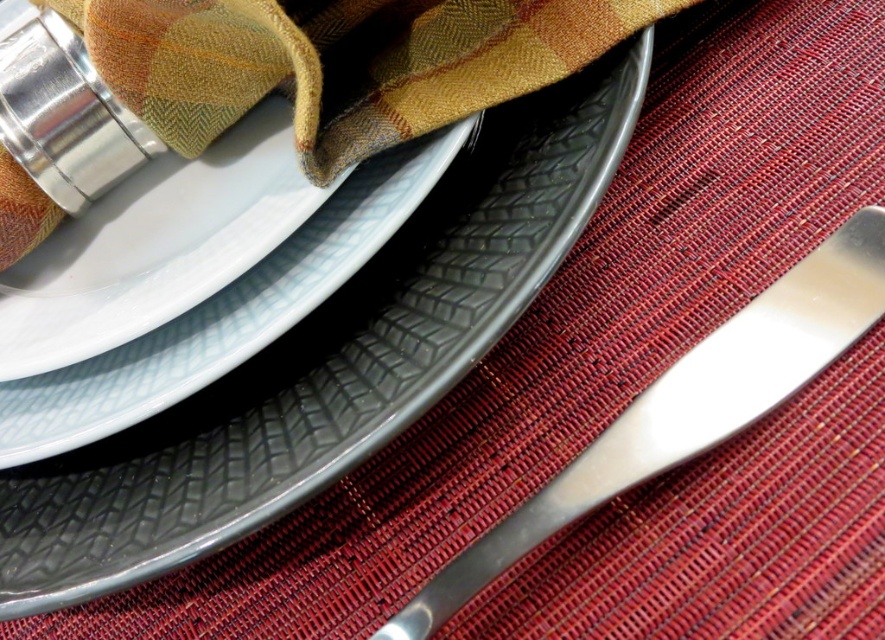
You are a GUI agent. You are given a task and a screenshot of the screen. Output one action in this format:
    pyautogui.click(x=<x>, y=<y>)
    Task: Click on the polished metal butter knife at lower right
    
    Given the screenshot: What is the action you would take?
    pyautogui.click(x=686, y=406)

Identify the location of polished metal butter knife at lower right. (686, 406).

Is the position of matte gray platter at center less distant than that of polished metal butter knife at lower right?

No, it is behind polished metal butter knife at lower right.

Who is more forward, (x=618, y=97) or (x=724, y=369)?

Point (x=724, y=369)

Locate an element on the screen. matte gray platter at center is located at coordinates (329, 362).

Does point (485, 243) lie in front of point (93, 412)?

No, it is behind (93, 412).

Who is taller, matte gray platter at center or matte gray plate at center?

Standing taller between the two is matte gray platter at center.

Between point (104, 540) and point (304, 257), which one is positioned behind?

The point (304, 257) is behind.

Where is `matte gray platter at center`? matte gray platter at center is located at coordinates (329, 362).